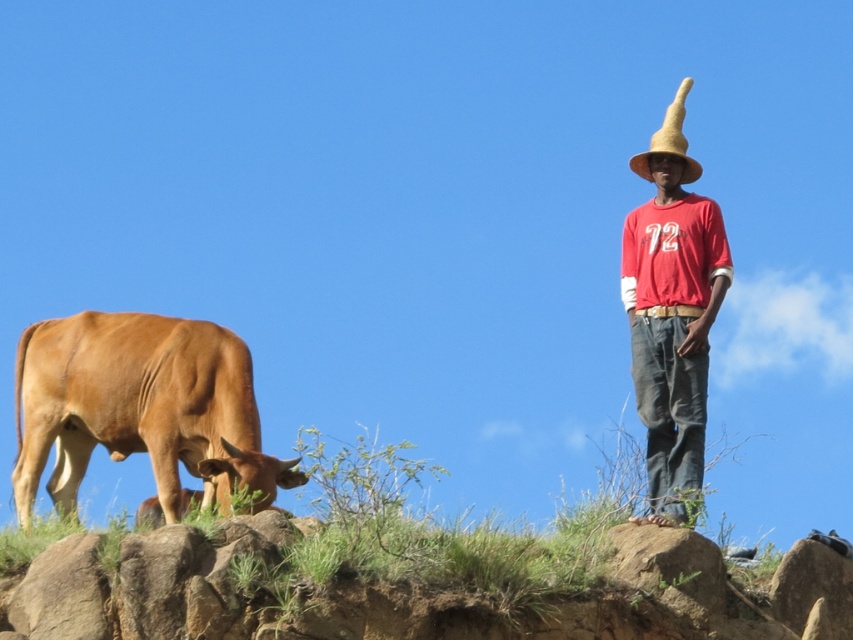
Image resolution: width=853 pixels, height=640 pixels. Describe the element at coordinates (671, 310) in the screenshot. I see `red cotton shirt at right` at that location.

Which is more to the left, red cotton shirt at right or straw at right?

From the viewer's perspective, red cotton shirt at right appears more on the left side.

Who is more distant from viewer, (682,422) or (668,122)?

Point (668,122)

At what (x,y) coordinates should I click in order to perform the action: click on red cotton shirt at right. Please return your answer as a coordinate pair (x, y). This screenshot has height=640, width=853. Looking at the image, I should click on (671, 310).

Between brown smooth bull at left and straw at right, which one is positioned lower?

brown smooth bull at left

Can you confirm if brown smooth bull at left is thinner than straw at right?

In fact, brown smooth bull at left might be wider than straw at right.

Is point (117, 314) farther from viewer compared to point (685, 145)?

Yes, it is behind point (685, 145).

Where is `brown smooth bull at left`? This screenshot has width=853, height=640. brown smooth bull at left is located at coordinates (138, 406).

Measure the distance from brown smooth bull at left to red cotton shirt at right.

The distance of brown smooth bull at left from red cotton shirt at right is 13.56 feet.

Can you confirm if brown smooth bull at left is positioned to the right of red cotton shirt at right?

Incorrect, brown smooth bull at left is not on the right side of red cotton shirt at right.

The height and width of the screenshot is (640, 853). I want to click on brown smooth bull at left, so pos(138,406).